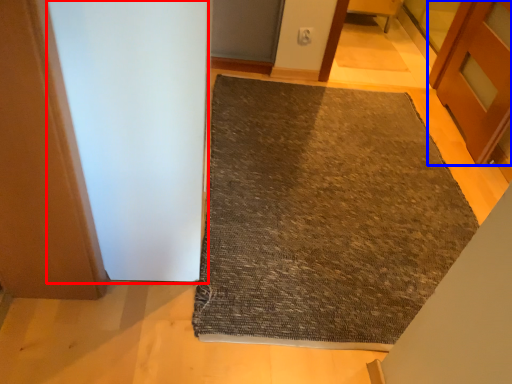
Question: Which of the following is the closest to the observer, screen door (highlighted by a red box) or door (highlighted by a blue box)?

Choices:
 (A) screen door
 (B) door

Answer: (A)